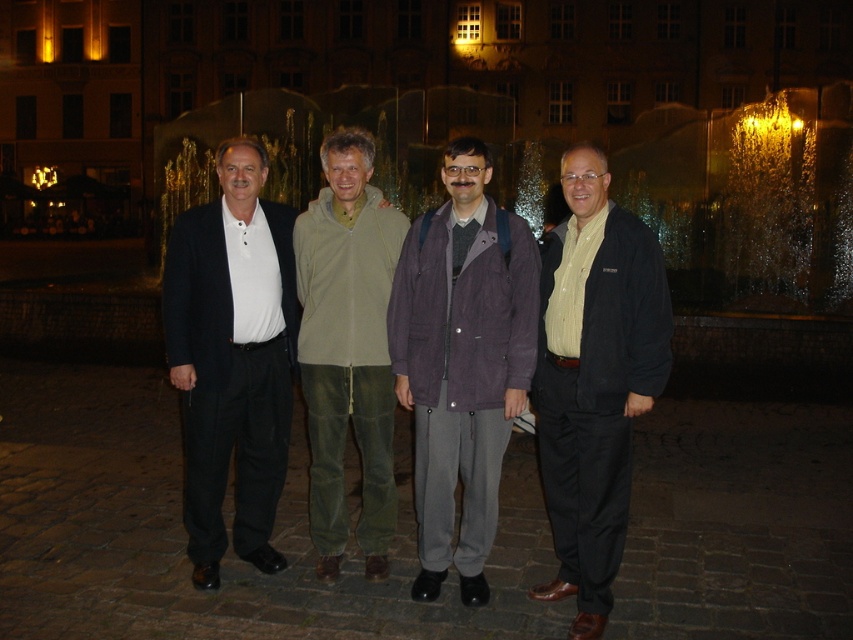
Describe the element at coordinates (231, 356) in the screenshot. I see `matte black suit at left` at that location.

Identify the location of matte black suit at left. The height and width of the screenshot is (640, 853). (231, 356).

What do you see at coordinates (462, 362) in the screenshot? I see `purple fabric jacket at center` at bounding box center [462, 362].

Who is positioned more to the left, purple fabric jacket at center or olive-green corduroy pants at center?

Positioned to the left is olive-green corduroy pants at center.

You are a GUI agent. You are given a task and a screenshot of the screen. Output one action in this format:
    pyautogui.click(x=<x>, y=<y>)
    Task: Click on the purple fabric jacket at center
    Image resolution: width=853 pixels, height=640 pixels.
    Given the screenshot: What is the action you would take?
    pyautogui.click(x=462, y=362)

At what (x,y) coordinates should I click in order to perform the action: click on purple fabric jacket at center. Please return your answer as a coordinate pair (x, y). The height and width of the screenshot is (640, 853). Looking at the image, I should click on (462, 362).

Does matte black jacket at right have a greater width compared to matte black suit at left?

No.

Who is positioned more to the left, matte black jacket at right or matte black suit at left?

From the viewer's perspective, matte black suit at left appears more on the left side.

Is point (660, 300) behind point (241, 180)?

No, it is not.

Find the location of a particular element. This screenshot has width=853, height=640. matte black jacket at right is located at coordinates (595, 380).